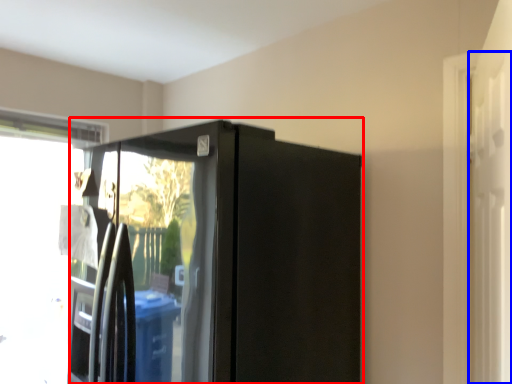
Question: Which object appears closest to the camera in this image, appliance (highlighted by a red box) or screen door (highlighted by a blue box)?

Choices:
 (A) appliance
 (B) screen door

Answer: (B)